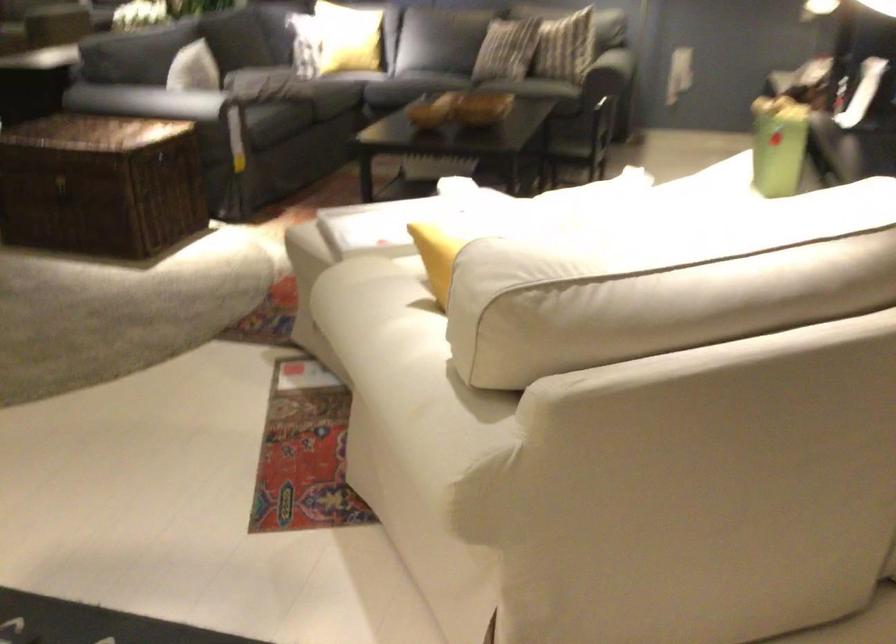
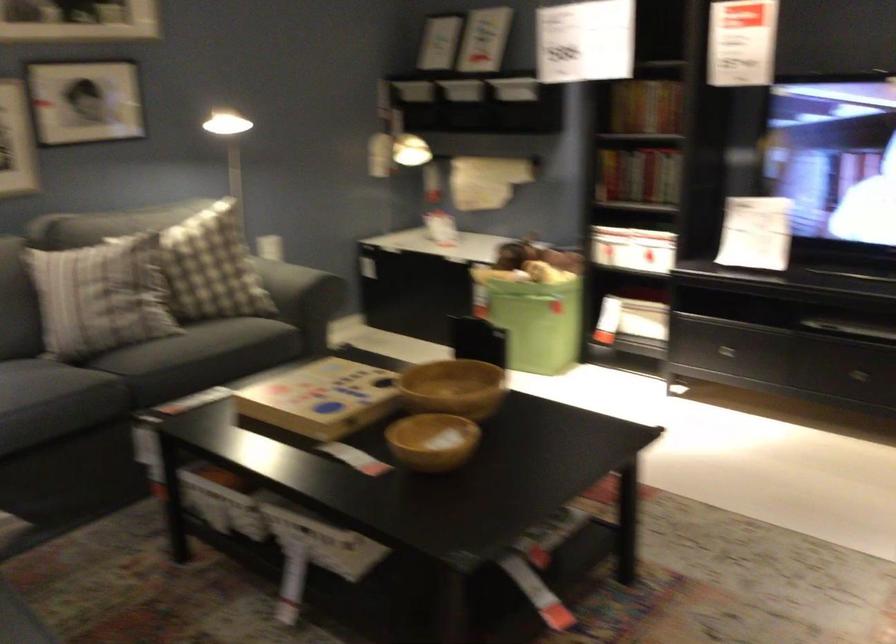
Where in the second image is the point corresponding to pixel 494 104 from the first image?

(453, 388)